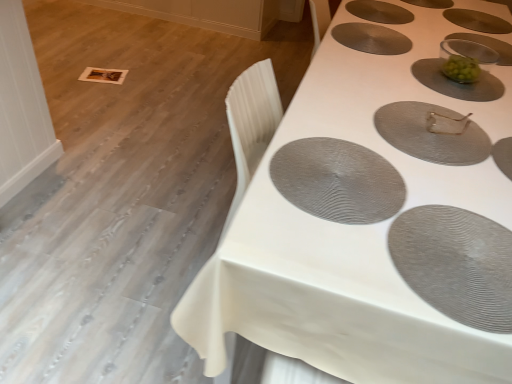
Find the location of `free space between textured gray oval at center, placed as the second oval when sorted from front to back, and gray textured placemat at lower right, the first oval from the front`. free space between textured gray oval at center, placed as the second oval when sorted from front to back, and gray textured placemat at lower right, the first oval from the front is located at coordinates (392, 211).